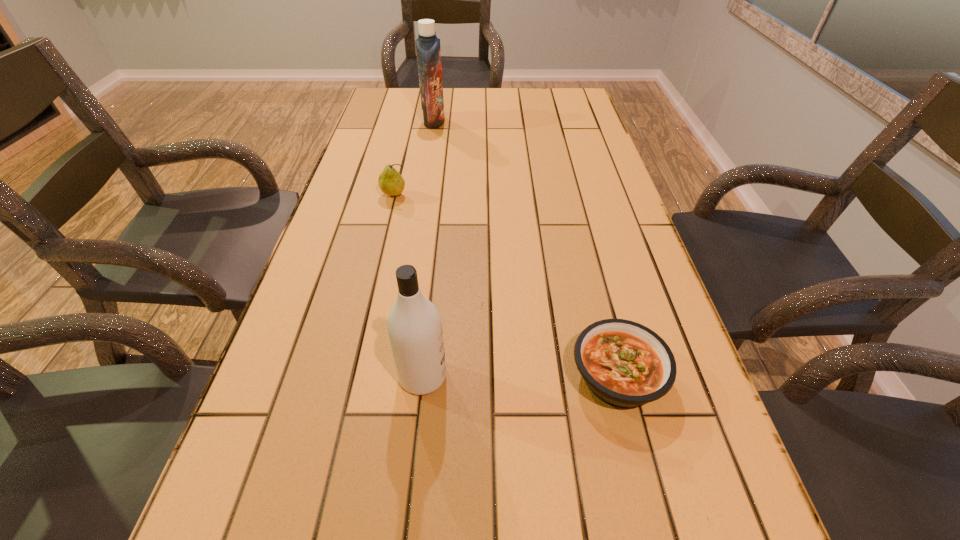
The image size is (960, 540). Identify the location of object that stands as the second closest to the second shortest object. (414, 325).

Find the location of a particular element. The width and height of the screenshot is (960, 540). free location that satisfies the following two spatial constraints: 1. on the front label of the rightmost object; 2. on the left side of the farther shampoo is located at coordinates (393, 376).

At what (x,y) coordinates should I click in order to perform the action: click on vacant region that satisfies the following two spatial constraints: 1. on the front label of the farther shampoo; 2. on the left side of the stew. Please return your answer as a coordinate pair (x, y). The width and height of the screenshot is (960, 540). Looking at the image, I should click on (393, 376).

You are a GUI agent. You are given a task and a screenshot of the screen. Output one action in this format:
    pyautogui.click(x=<x>, y=<y>)
    Task: Click on the free location that satisfies the following two spatial constraints: 1. on the front label of the shortest object; 2. on the left side of the farthest object
    
    Given the screenshot: What is the action you would take?
    pyautogui.click(x=393, y=376)

Identify the location of vacant region that satisfies the following two spatial constraints: 1. on the front label of the rightmost object; 2. on the right side of the farthest object. (393, 376).